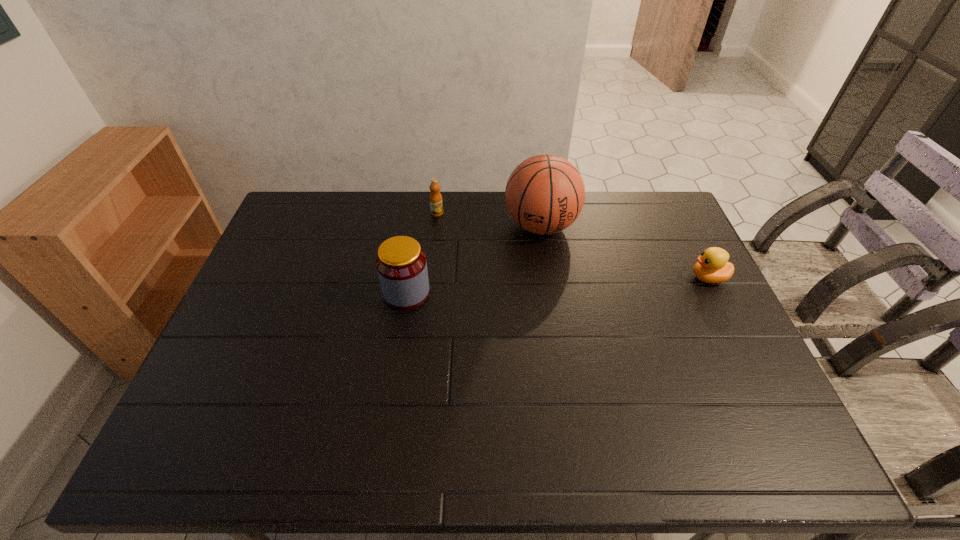
You are a GUI agent. You are given a task and a screenshot of the screen. Output one action in this format:
    pyautogui.click(x=<x>, y=<y>)
    Task: Click on the free space located 0.230m on the surface of the third object from left to right near the brand logo
    
    Given the screenshot: What is the action you would take?
    pyautogui.click(x=556, y=305)

Locate an element on the screen. This screenshot has width=960, height=540. free space located 0.130m on the surface of the third object from left to right near the brand logo is located at coordinates click(x=551, y=280).

Identify the location of vacant area situated 0.220m on the surface of the third object from left to right near the brand logo. (555, 302).

Locate an element on the screen. free space located 0.270m on the front label of the orange juice is located at coordinates (488, 258).

Locate an element on the screen. The width and height of the screenshot is (960, 540). free space located 0.180m on the front label of the orange juice is located at coordinates (470, 243).

This screenshot has width=960, height=540. I want to click on free spot located 0.280m on the front label of the orange juice, so click(490, 259).

I want to click on basketball positioned at the far edge, so click(x=545, y=194).

This screenshot has height=540, width=960. Identify the location of orange juice located at the far edge. (x=436, y=204).

Locate an element on the screen. This screenshot has width=960, height=540. object that is at the right edge is located at coordinates (712, 267).

Find the location of a particular element. The width and height of the screenshot is (960, 540). vacant region at the far edge of the desktop is located at coordinates (396, 195).